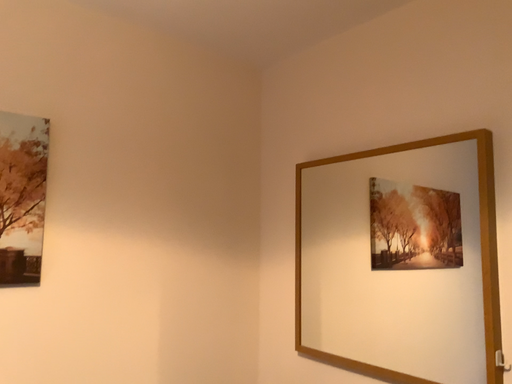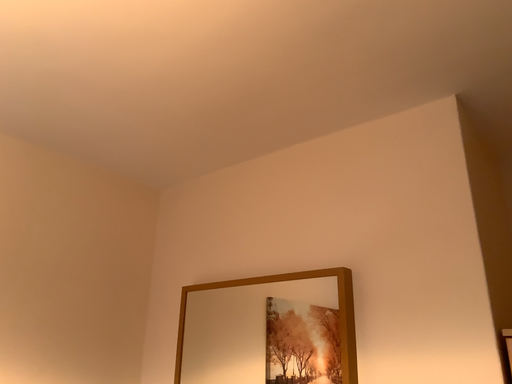
Question: Which way did the camera rotate in the video?

Choices:
 (A) rotated left
 (B) rotated right

Answer: (B)